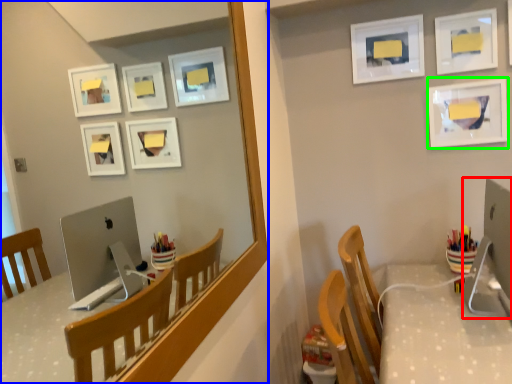
Question: Considering the real-world distances, which object is closest to desktop computer (highlighted by a red box)? mirror (highlighted by a blue box) or picture frame (highlighted by a green box).

Choices:
 (A) mirror
 (B) picture frame

Answer: (B)